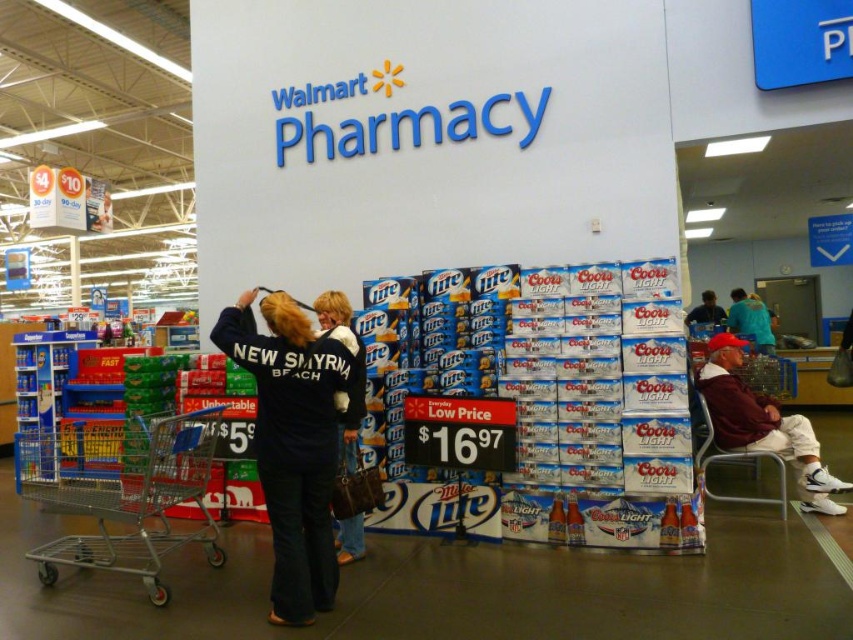
Question: Which point is closer to the camera?

Choices:
 (A) (770, 323)
 (B) (694, 310)

Answer: (A)

Question: Can you confirm if white cotton pants at lower right is bigger than dark blue shirt at center?

Choices:
 (A) no
 (B) yes

Answer: (B)

Question: Which of the following is the closest to the observer?

Choices:
 (A) (805, 472)
 (B) (766, 324)
 (C) (329, 368)
 (D) (119, 568)

Answer: (C)

Question: Can you confirm if dark blue fleece jacket at center is positioned above teal fabric shirt at center?

Choices:
 (A) yes
 (B) no

Answer: (B)

Question: Which is farther from the teal fabric shirt at center?

Choices:
 (A) metallic silver shopping cart at lower left
 (B) dark blue denim jacket at center
 (C) dark blue shirt at center
 (D) dark blue fleece jacket at center

Answer: (A)

Question: In this image, where is white cotton pants at lower right located relative to dark blue shirt at center?

Choices:
 (A) below
 (B) above

Answer: (A)